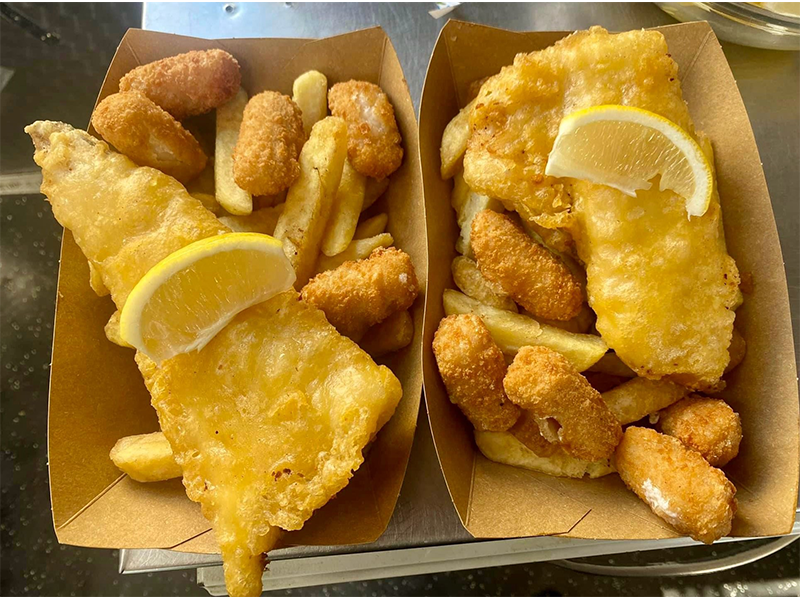
Locate an element on the screen. This screenshot has width=800, height=600. floor is located at coordinates (30, 98), (26, 355).